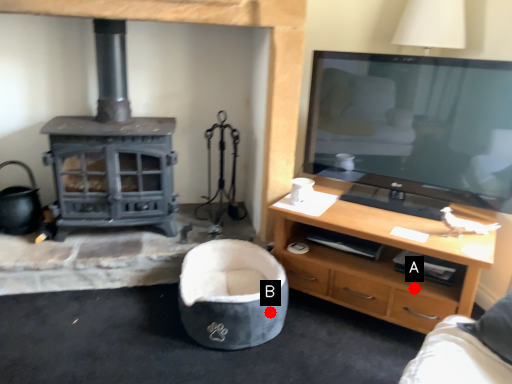
Question: Two points are circled on the image, labeled by A and B beside each circle. Which point is closer to the camera?

Choices:
 (A) A is closer
 (B) B is closer

Answer: (B)